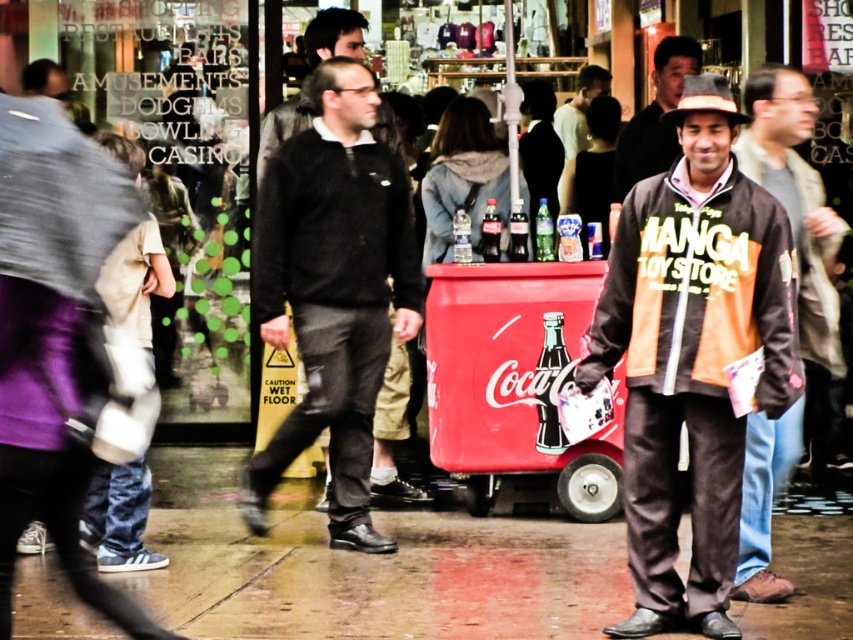
Is translucent plastic bottle at center wider than clear glass bottle at center?

In fact, translucent plastic bottle at center might be narrower than clear glass bottle at center.

What do you see at coordinates (517, 232) in the screenshot?
I see `translucent plastic bottle at center` at bounding box center [517, 232].

This screenshot has width=853, height=640. I want to click on translucent plastic bottle at center, so click(x=517, y=232).

Can you confirm if shiny concrete pavement at lower center is positioned to the right of matte gray hat at upper right?

In fact, shiny concrete pavement at lower center is to the left of matte gray hat at upper right.

Looking at this image, how much distance is there between shiny concrete pavement at lower center and matte gray hat at upper right?

shiny concrete pavement at lower center is 3.79 meters away from matte gray hat at upper right.

This screenshot has width=853, height=640. Describe the element at coordinates (383, 577) in the screenshot. I see `shiny concrete pavement at lower center` at that location.

In order to click on shiny concrete pavement at lower center in this screenshot , I will do `click(383, 577)`.

At what (x,y) coordinates should I click in order to perform the action: click on black sweater at center. Please return your answer as a coordinate pair (x, y). The width and height of the screenshot is (853, 640). Looking at the image, I should click on (334, 228).

Is black sweater at center further to camera compared to orange cotton jacket at center?

Yes, it is.

At what (x,y) coordinates should I click in order to perform the action: click on black sweater at center. Please return your answer as a coordinate pair (x, y). Looking at the image, I should click on (334, 228).